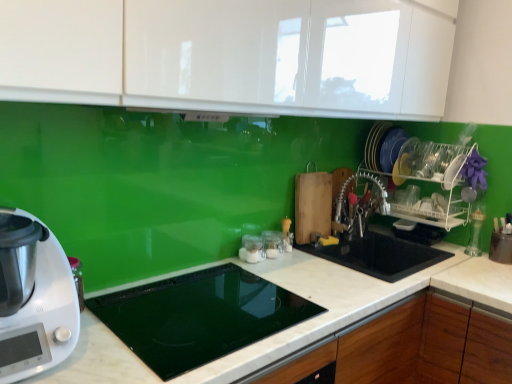
Question: From a real-world perspective, is white marble countertop at center above or below white plastic food processor at lower left?

Choices:
 (A) below
 (B) above

Answer: (A)

Question: Is white marble countertop at center in front of or behind white plastic food processor at lower left in the image?

Choices:
 (A) front
 (B) behind

Answer: (A)

Question: Considering the real-world distances, which object is closest to the clear glass jars at center, which is the 1th appliance from back to front?

Choices:
 (A) white plastic food processor at lower left
 (B) clear glass jar at center, marked as the 2th appliance in a back-to-front arrangement
 (C) satin nickel faucet at center right
 (D) black glass cooktop at center, which appears as the 3th appliance when viewed from the back
 (E) white glossy cabinet at upper center

Answer: (B)

Question: Considering the real-world distances, which object is closest to the satin nickel faucet at center right?

Choices:
 (A) white plastic food processor at lower left
 (B) white glossy cabinet at upper center
 (C) black glass cooktop at center, which appears as the 1th appliance when viewed from the front
 (D) clear glass jars at center, which is the 1th appliance from back to front
 (E) white marble countertop at center

Answer: (D)